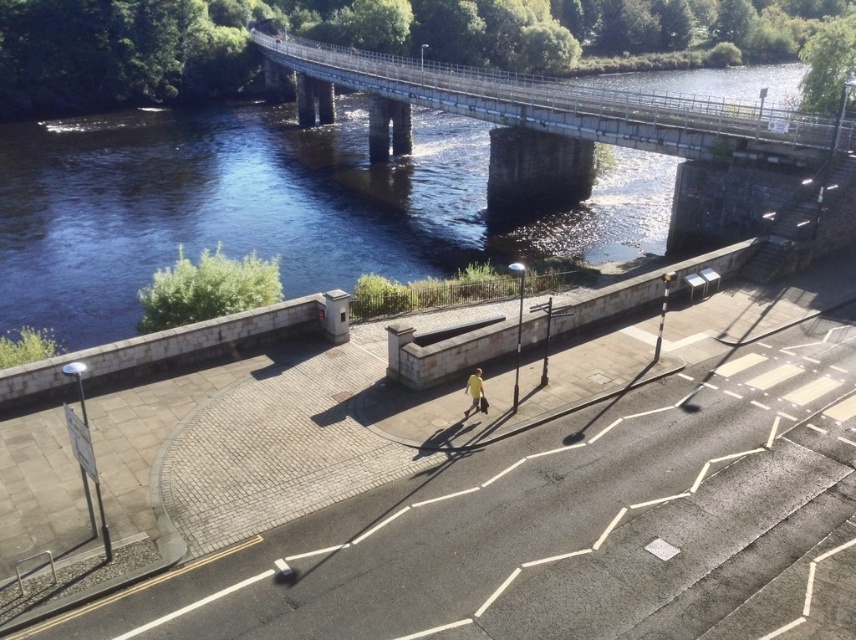
You are a photographer planning to take a photo of the dark blue water at upper center and the yellow fabric at center. Based on the scene description, which object is positioned higher in the image?

The dark blue water at upper center is positioned higher in the image than the yellow fabric at center because it is described as much taller.

You are standing at the pedestrian walkway on the left side of the bridge and want to reach the point marked as point (316, 168) and point (467, 413). Which point should you head towards first if you want to minimize the distance walked?

You should head towards point (316, 168) first because it is closer to you than point (467, 413) since it is further away from the viewer.

You are standing on the bridge and want to take a photo of the dark blue water at upper center and the yellow fabric at center. Which object should you focus on first to ensure both are in sharp focus?

You should focus on the yellow fabric at center first because it is closer to you than the dark blue water at upper center, which is further away. This way, both will be in focus as the yellow fabric is the nearer object.